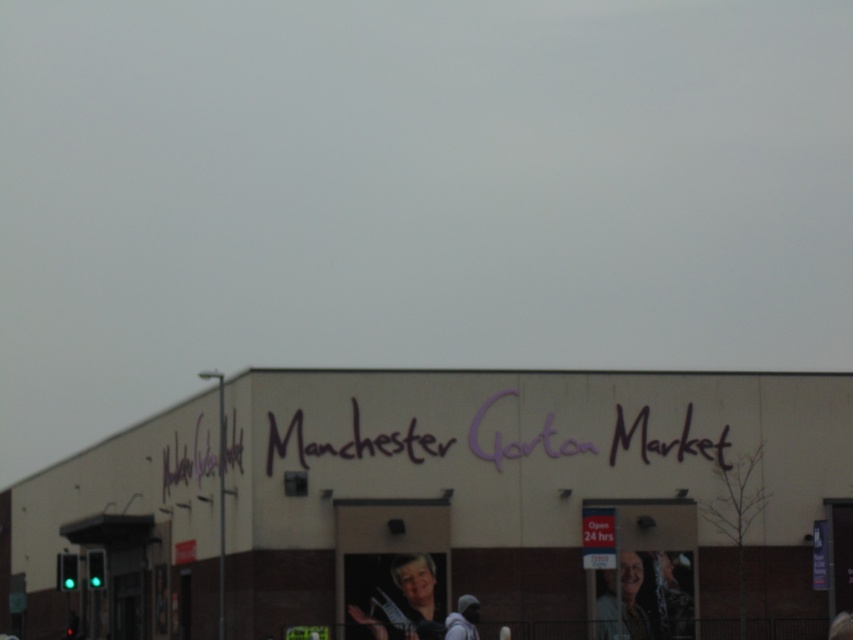
Question: Does white matte building at center come in front of smooth plastic poster at lower right?

Choices:
 (A) no
 (B) yes

Answer: (B)

Question: Which point is closer to the camera taking this photo?

Choices:
 (A) (630, 582)
 (B) (505, 600)

Answer: (B)

Question: Which object is farther from the camera taking this photo?

Choices:
 (A) white matte building at center
 (B) matte black jacket at lower center

Answer: (B)

Question: Among these points, which one is farthest from the camera?

Choices:
 (A) (566, 557)
 (B) (619, 604)

Answer: (A)

Question: From the image, what is the correct spatial relationship of matte black jacket at lower center in relation to smooth plastic poster at lower right?

Choices:
 (A) below
 (B) above

Answer: (B)

Question: Does white matte building at center appear on the right side of smooth plastic poster at lower right?

Choices:
 (A) yes
 (B) no

Answer: (B)